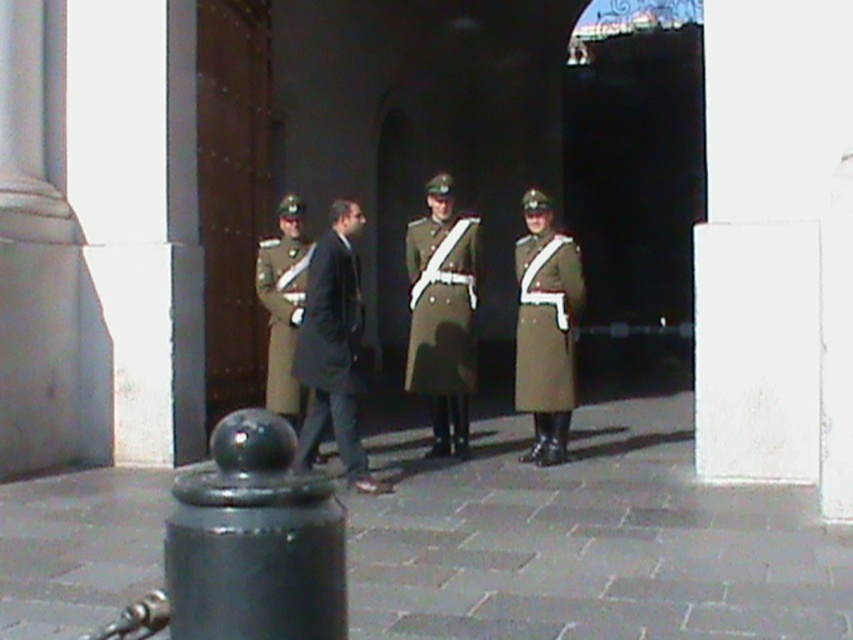
You are a photographer positioned at the front of the scene. You want to take a photo that includes both the military green uniform at center and the dark gray wool coat at center. Which object should you adjust your camera angle to focus on first to ensure both are in frame?

The dark gray wool coat at center is behind the military green uniform at center, so you should focus on the military green uniform at center first to ensure both are visible in the frame.

You are a visitor at this formal building and want to take a photo of the black bollard with the guards in the background. However, you notice two points marked in the scene. The first point is at coordinate point [444,422] and the second is at point [329,316]. Which point should you stand at to ensure the guards are fully visible behind the bollard?

You should stand at point [329,316] because point [444,422] is behind point [329,316], meaning standing there would block the view of the guards behind the bollard.

You are standing in front of a formal building and need to place a 6.5 feet long decorative banner between yourself and the black rubber bollard at lower left. Can the banner fit without overlapping the bollard?

The distance between you and the black rubber bollard at lower left is 7.13 feet, which is greater than the banner length of 6.5 feet. Therefore, the banner can be placed without overlapping the bollard.